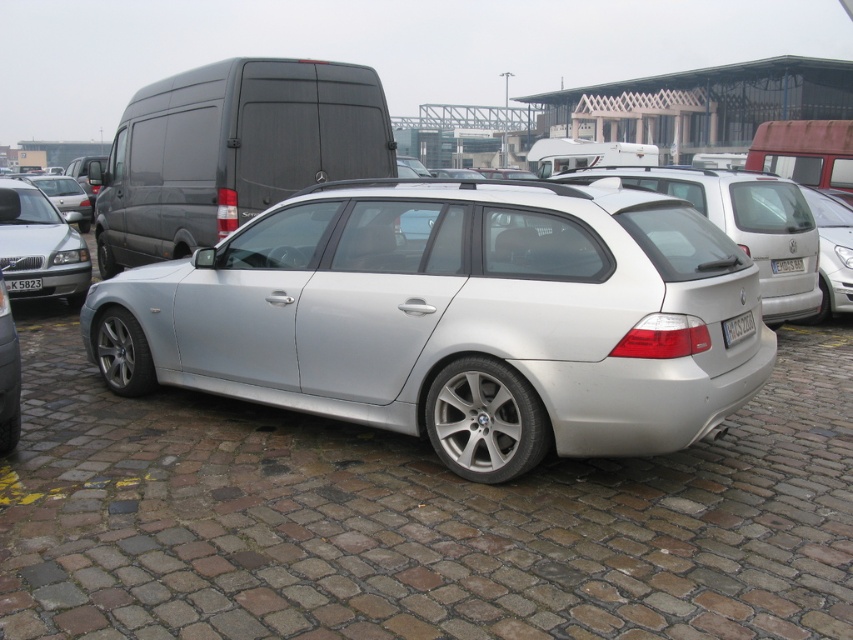
Between matte black van at upper left and silver metallic sedan at left, which one has more height?

silver metallic sedan at left is taller.

Does matte black van at upper left have a larger size compared to silver metallic sedan at left?

No.

The image size is (853, 640). What do you see at coordinates (231, 150) in the screenshot?
I see `matte black van at upper left` at bounding box center [231, 150].

Locate an element on the screen. matte black van at upper left is located at coordinates (231, 150).

Is silver metallic sedan at left to the right of white plastic license plate at rear from the viewer's perspective?

Incorrect, silver metallic sedan at left is not on the right side of white plastic license plate at rear.

Between silver metallic sedan at left and white plastic license plate at rear, which one appears on the left side from the viewer's perspective?

silver metallic sedan at left

Identify the location of silver metallic sedan at left. This screenshot has width=853, height=640. (44, 248).

Is silver metallic car at center above matte silver car at left?

Incorrect, silver metallic car at center is not positioned above matte silver car at left.

Which is more to the right, silver metallic car at center or matte silver car at left?

silver metallic car at center

This screenshot has width=853, height=640. In order to click on silver metallic car at center in this screenshot , I will do `click(456, 317)`.

The image size is (853, 640). I want to click on silver metallic car at center, so click(x=456, y=317).